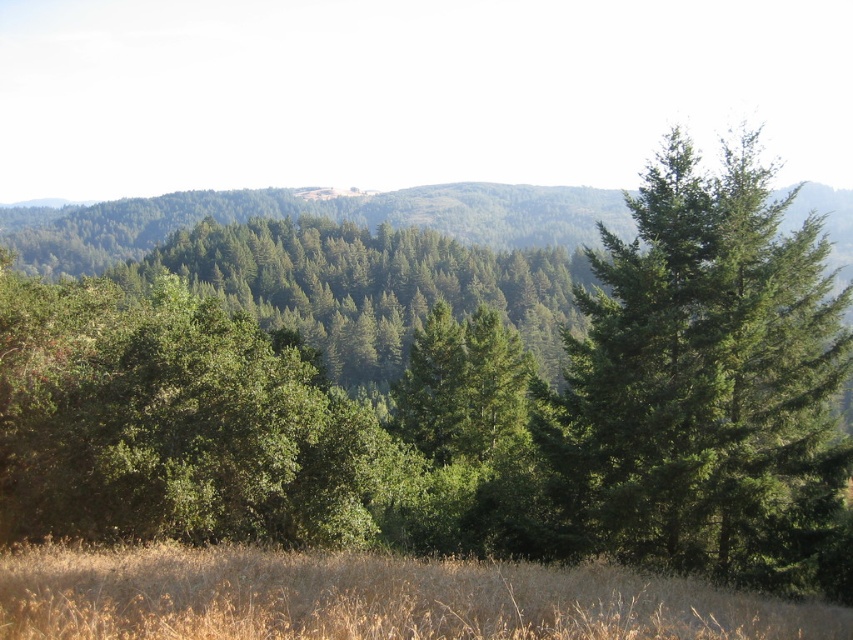
Question: Estimate the real-world distances between objects in this image. Which object is closer to the dry grass at lower center?

Choices:
 (A) green matte tree at center
 (B) green needle-like tree at right

Answer: (B)

Question: Is green needle-like tree at right wider than dry grass at lower center?

Choices:
 (A) yes
 (B) no

Answer: (A)

Question: Which point is closer to the camera?

Choices:
 (A) green needle-like tree at right
 (B) green matte tree at center
 (C) dry grass at lower center

Answer: (C)

Question: Estimate the real-world distances between objects in this image. Which object is closer to the dry grass at lower center?

Choices:
 (A) green needle-like tree at right
 (B) green matte tree at center

Answer: (A)

Question: Is green matte tree at center to the right of green needle-like tree at right from the viewer's perspective?

Choices:
 (A) no
 (B) yes

Answer: (A)

Question: Can you confirm if green matte tree at center is positioned above dry grass at lower center?

Choices:
 (A) yes
 (B) no

Answer: (A)